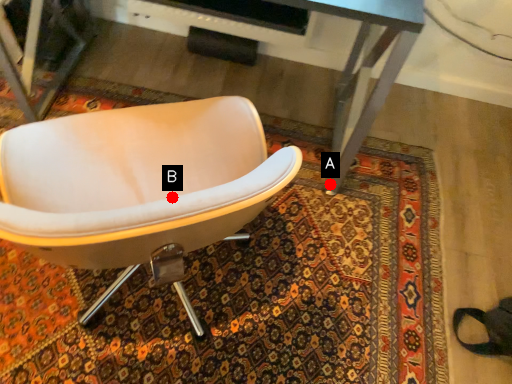
Question: Two points are circled on the image, labeled by A and B beside each circle. Which point is further to the camera?

Choices:
 (A) A is further
 (B) B is further

Answer: (A)